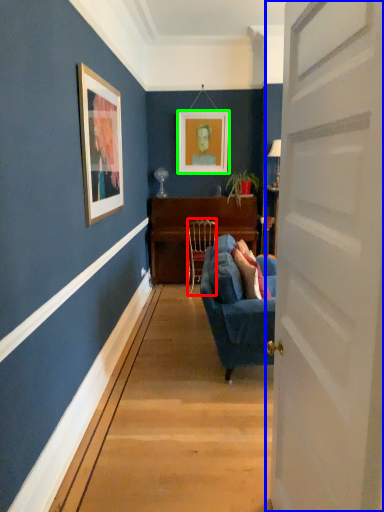
Question: Based on their relative distances, which object is nearer to chair (highlighted by a red box)? Choose from door (highlighted by a blue box) and picture frame (highlighted by a green box).

Choices:
 (A) door
 (B) picture frame

Answer: (B)